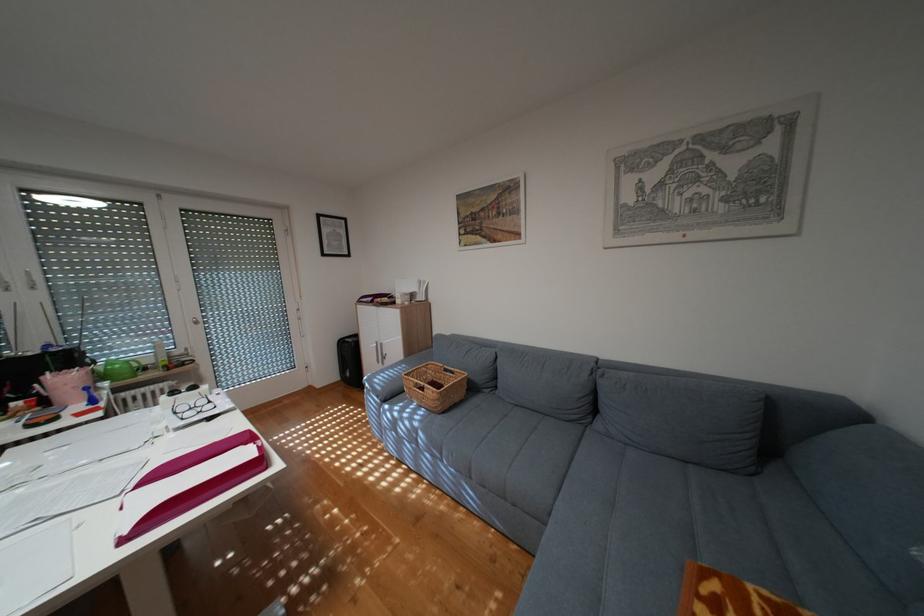
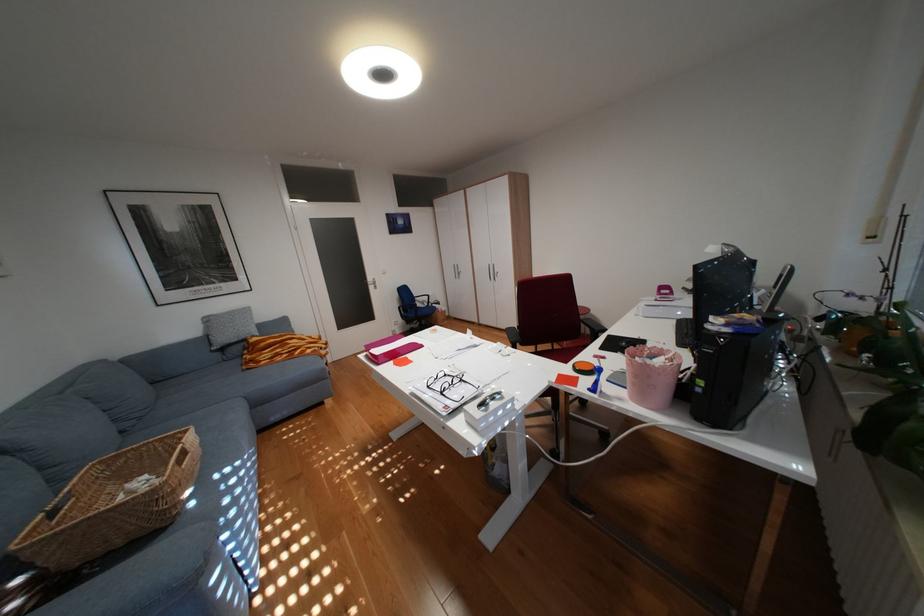
Find the pixel in the second image that matches (x=222, y=400) in the first image.

(454, 392)